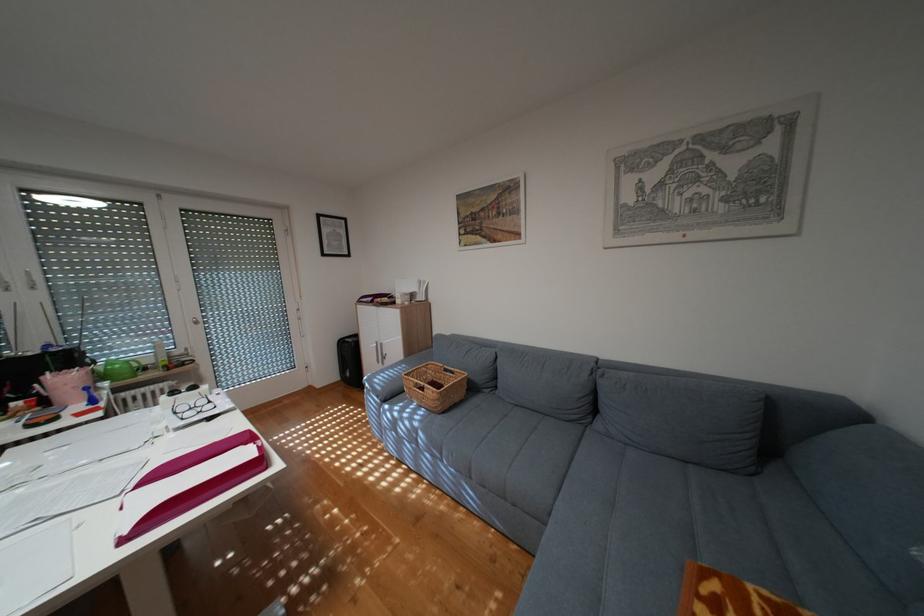
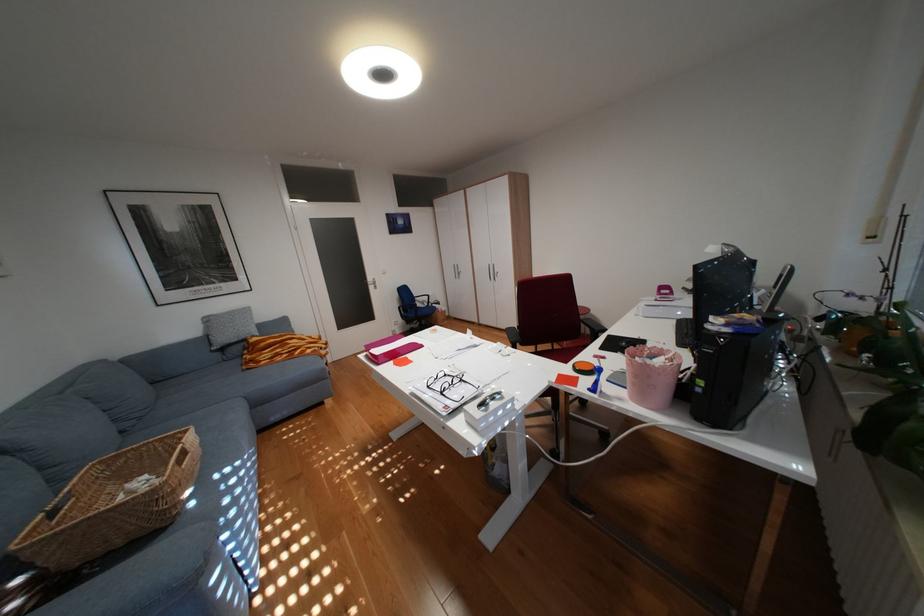
Find the pixel in the second image that matches (x=222, y=400) in the first image.

(454, 392)